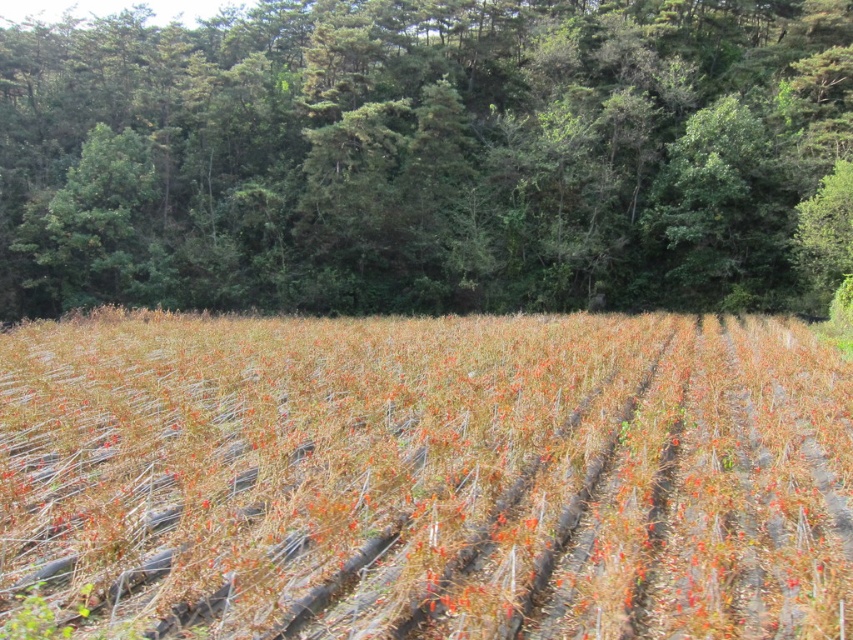
Question: Is brown dry grass at center positioned at the back of green leafy tree at upper center?

Choices:
 (A) yes
 (B) no

Answer: (B)

Question: Is brown dry grass at center wider than green leafy tree at upper center?

Choices:
 (A) yes
 (B) no

Answer: (B)

Question: Which point is farther to the camera?

Choices:
 (A) green leafy tree at upper center
 (B) brown dry grass at center

Answer: (A)

Question: Which of the following is the farthest from the observer?

Choices:
 (A) green leafy tree at upper center
 (B) brown dry grass at center

Answer: (A)

Question: Is brown dry grass at center wider than green leafy tree at upper center?

Choices:
 (A) no
 (B) yes

Answer: (A)

Question: Which point is farther from the camera taking this photo?

Choices:
 (A) (82, 552)
 (B) (218, 189)

Answer: (B)